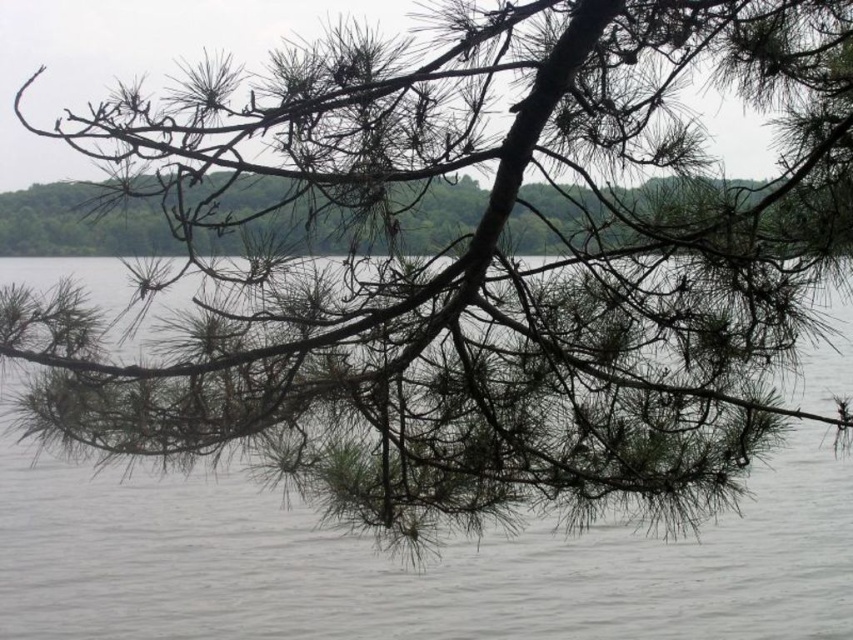
Does gray matte water at center appear on the right side of brown textured pine branch at center?

Indeed, gray matte water at center is positioned on the right side of brown textured pine branch at center.

This screenshot has height=640, width=853. Describe the element at coordinates (410, 566) in the screenshot. I see `gray matte water at center` at that location.

Image resolution: width=853 pixels, height=640 pixels. Find the location of `gray matte water at center`. gray matte water at center is located at coordinates (410, 566).